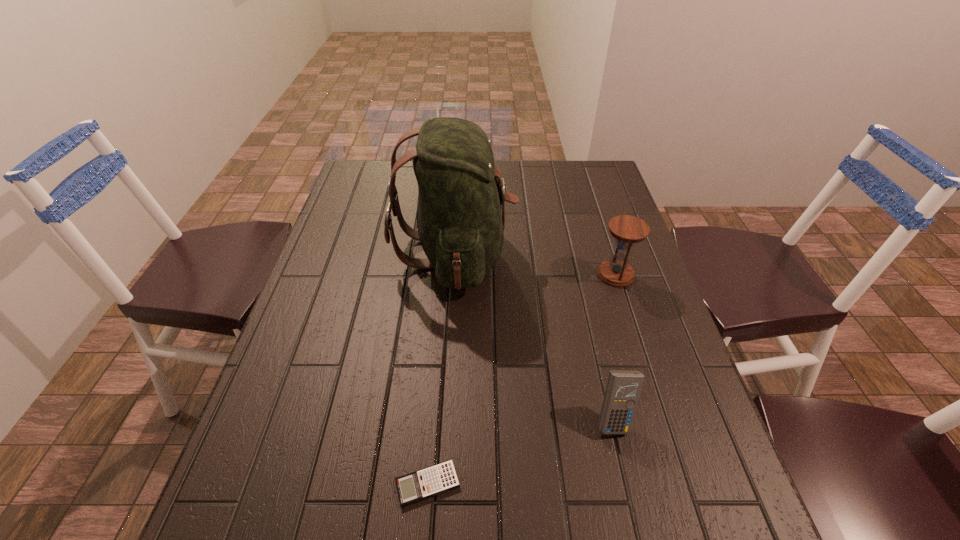
At what (x,y) coordinates should I click in order to perform the action: click on vacant space that's between the second nearest object and the backpack. Please return your answer as a coordinate pair (x, y). This screenshot has height=540, width=960. Looking at the image, I should click on (534, 336).

Where is `free point between the second tallest object and the third tallest object`? The width and height of the screenshot is (960, 540). free point between the second tallest object and the third tallest object is located at coordinates (614, 347).

Locate an element on the screen. vacant space that is in between the backpack and the left calculator is located at coordinates (442, 368).

The image size is (960, 540). Identify the location of vacant space that's between the nearest object and the tallest object. (442, 368).

This screenshot has height=540, width=960. In order to click on vacant space in between the backpack and the third shortest object in this screenshot , I will do `click(535, 264)`.

Find the location of `vacant region between the second object from right to left and the rightmost object`. vacant region between the second object from right to left and the rightmost object is located at coordinates (614, 347).

The width and height of the screenshot is (960, 540). In order to click on object that is the second closest to the hourglass in this screenshot , I will do `click(623, 388)`.

I want to click on the closest object to the shorter calculator, so click(623, 388).

This screenshot has height=540, width=960. Find the location of `vacant space that satisfies the following two spatial constraints: 1. on the open flap of the tallest object; 2. on the back side of the rightmost object`. vacant space that satisfies the following two spatial constraints: 1. on the open flap of the tallest object; 2. on the back side of the rightmost object is located at coordinates (453, 274).

Locate an element on the screen. The height and width of the screenshot is (540, 960). vacant space that satisfies the following two spatial constraints: 1. on the back side of the shortest object; 2. on the right side of the third shortest object is located at coordinates (444, 274).